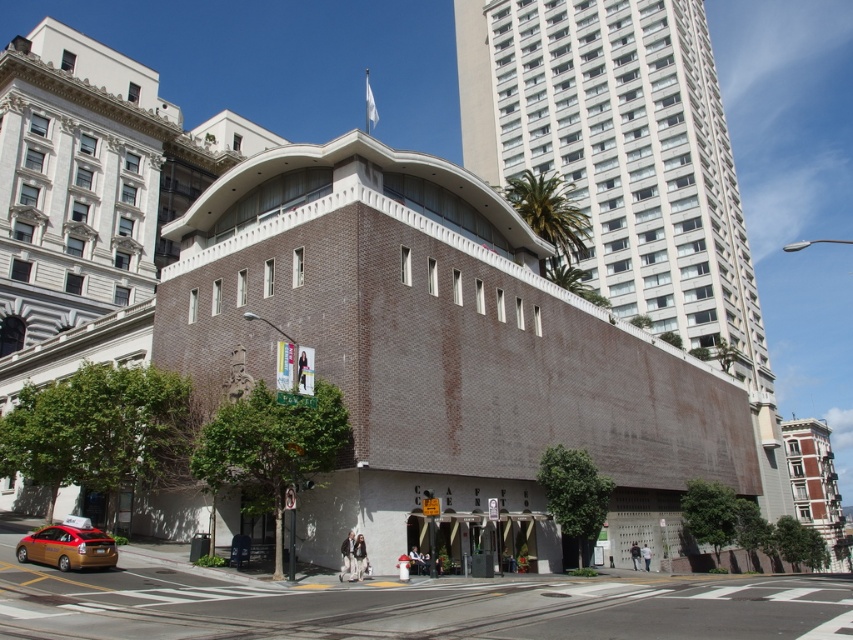
Based on the photo, you are an architect evaluating two buildings in the city. You see the smooth beige building at center and the red brick building at right. Which building has a greater height?

The smooth beige building at center is much taller than the red brick building at right, so it has a greater height.

You are standing in the city and want to take a photo of the smooth beige building at center and the gold metallic taxi at lower left. Which object should you focus on first to ensure both are in the frame?

You should focus on the gold metallic taxi at lower left first because it is closer to you than the smooth beige building at center, ensuring both are in the frame.